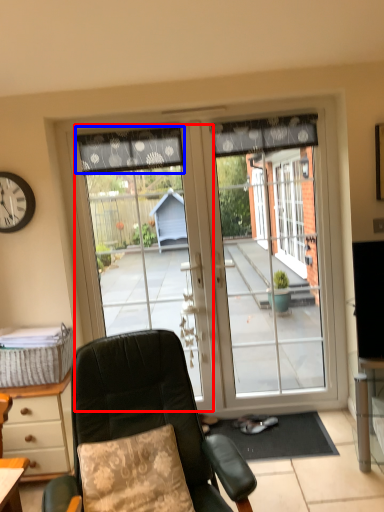
Question: Which object appears farthest to the camera in this image, garage door (highlighted by a red box) or curtain (highlighted by a blue box)?

Choices:
 (A) garage door
 (B) curtain

Answer: (A)